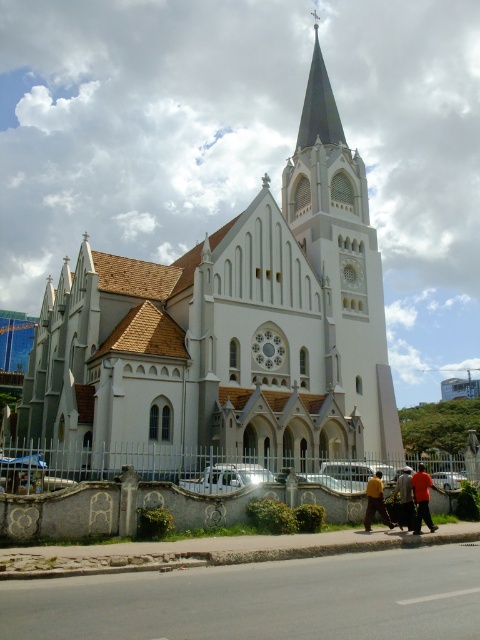
Does smooth gray steeple at upper center lie in front of red fabric pants at center?

No, it is not.

Who is shorter, smooth gray steeple at upper center or red fabric pants at center?

Standing shorter between the two is red fabric pants at center.

Which is in front, point (332, 134) or point (432, 484)?

Point (432, 484) is more forward.

Where is `smooth gray steeple at upper center`? smooth gray steeple at upper center is located at coordinates (319, 106).

Is the position of smooth gray steeple at upper center more distant than that of dark brown leather jacket at center?

Yes.

Who is lower down, smooth gray steeple at upper center or dark brown leather jacket at center?

dark brown leather jacket at center is lower down.

Who is more distant from viewer, (312, 104) or (408, 480)?

The point (312, 104) is more distant.

Image resolution: width=480 pixels, height=640 pixels. What are the coordinates of `smooth gray steeple at upper center` in the screenshot? It's located at (319, 106).

Which is below, smooth gray steeple at upper center or yellow fabric pants at lower center?

yellow fabric pants at lower center

The width and height of the screenshot is (480, 640). What do you see at coordinates (319, 106) in the screenshot?
I see `smooth gray steeple at upper center` at bounding box center [319, 106].

Image resolution: width=480 pixels, height=640 pixels. I want to click on smooth gray steeple at upper center, so click(319, 106).